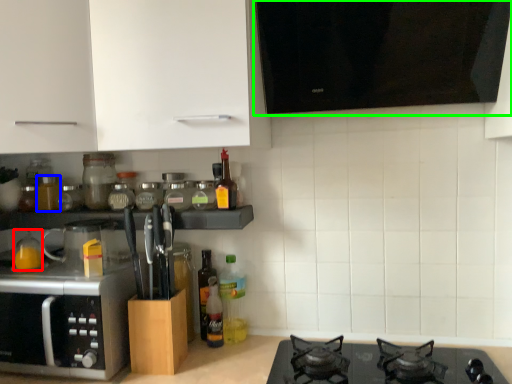
Question: Which object is the farthest from bottle (highlighted by a red box)? Choose among these: bottle (highlighted by a blue box) or vent (highlighted by a green box).

Choices:
 (A) bottle
 (B) vent

Answer: (B)